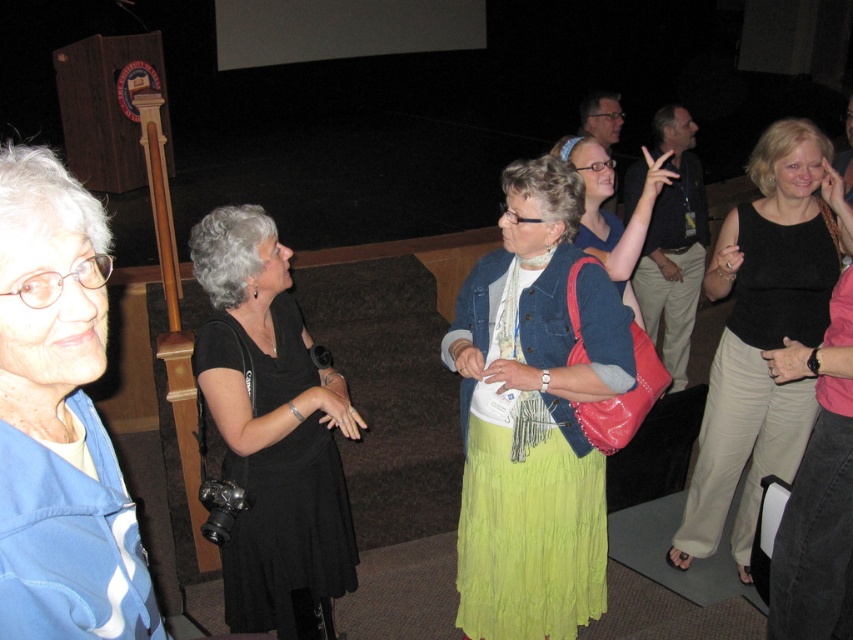
Question: Does black satin dress at center appear under black jersey at right?

Choices:
 (A) yes
 (B) no

Answer: (A)

Question: Is black smooth tank top at right wider than black jersey at right?

Choices:
 (A) no
 (B) yes

Answer: (B)

Question: Estimate the real-world distances between objects in this image. Which object is farther from the denim jacket at center?

Choices:
 (A) matte blue jacket at center
 (B) black satin dress at center
 (C) blue fabric jacket at upper left

Answer: (C)

Question: Which object is farther from the camera taking this photo?

Choices:
 (A) black jersey at right
 (B) black satin dress at center
 (C) black smooth tank top at right

Answer: (C)

Question: Among these objects, which one is nearest to the camera?

Choices:
 (A) black satin dress at center
 (B) black jersey at right
 (C) matte blue jacket at center

Answer: (B)

Question: Is black smooth tank top at right smaller than matte blue jacket at center?

Choices:
 (A) no
 (B) yes

Answer: (B)